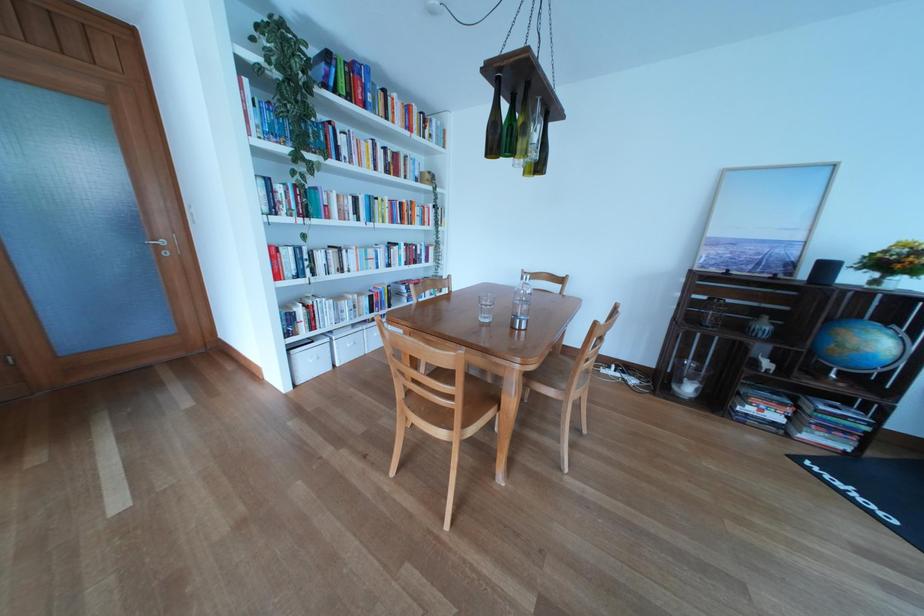
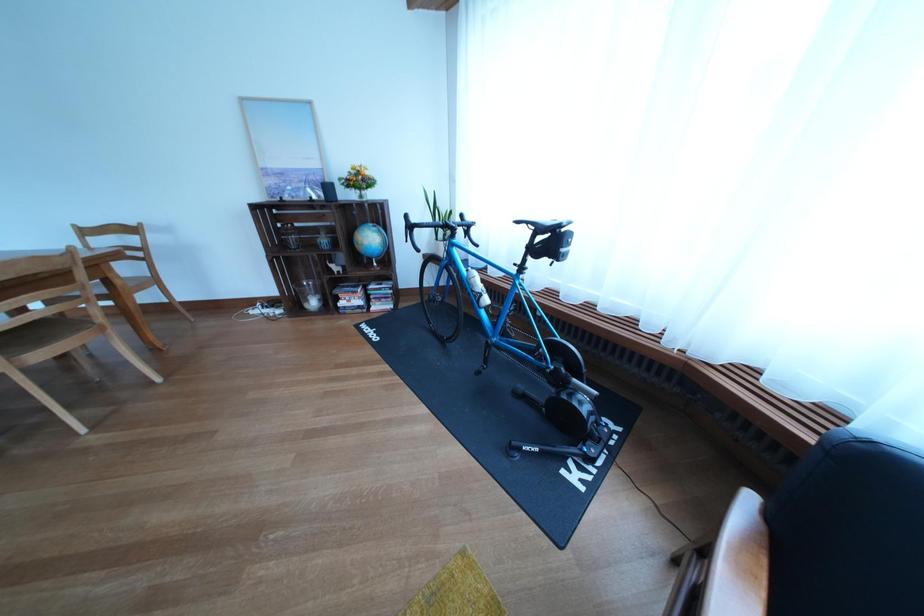
In the second image, find the point that corresponds to pixel 747 249 in the first image.

(294, 179)